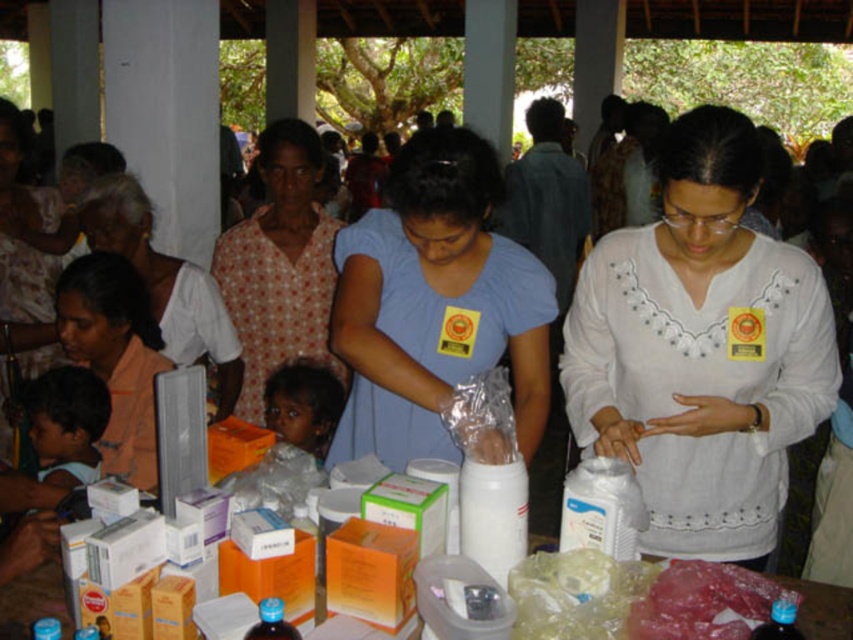
Who is taller, floral fabric dress at center or transparent plastic bottle at center?

floral fabric dress at center is taller.

Who is more distant from viewer, (283, 324) or (784, 596)?

The point (283, 324) is behind.

Locate an element on the screen. This screenshot has height=640, width=853. floral fabric dress at center is located at coordinates (279, 266).

You are a GUI agent. You are given a task and a screenshot of the screen. Output one action in this format:
    pyautogui.click(x=<x>, y=<y>)
    Task: Click on the floral fabric dress at center
    
    Given the screenshot: What is the action you would take?
    pyautogui.click(x=279, y=266)

Which is in front, point (491, 480) or point (287, 388)?

Point (491, 480)

Describe the element at coordinates (492, 515) in the screenshot. I see `white plastic container at center` at that location.

Find the location of a particular element. Image resolution: width=853 pixels, height=640 pixels. white plastic container at center is located at coordinates (492, 515).

Does matte pink shirt at lower left appear under smooth skin child at lower left?

Actually, matte pink shirt at lower left is above smooth skin child at lower left.

Can you confirm if matte pink shirt at lower left is bigger than smooth skin child at lower left?

Indeed, matte pink shirt at lower left has a larger size compared to smooth skin child at lower left.

Between point (144, 332) and point (57, 388), which one is positioned in front?

Point (57, 388) is in front.

You are a GUI agent. You are given a task and a screenshot of the screen. Output one action in this format:
    pyautogui.click(x=<x>, y=<y>)
    Task: Click on the matte pink shirt at lower left
    
    Given the screenshot: What is the action you would take?
    pyautogui.click(x=115, y=356)